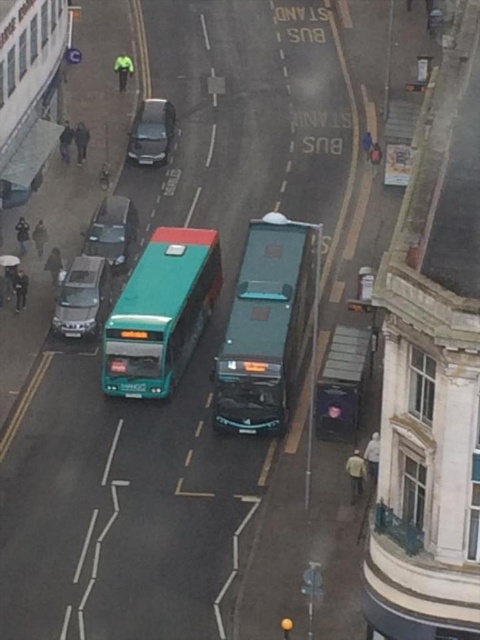
Question: Considering the relative positions of teal matte bus at center and metallic gray car at center in the image provided, where is teal matte bus at center located with respect to metallic gray car at center?

Choices:
 (A) below
 (B) above

Answer: (A)

Question: Estimate the real-world distances between objects in this image. Which object is farther from the green matte bus at center?

Choices:
 (A) metallic silver car at center-left
 (B) satin silver suv at left
 (C) metallic gray car at center
 (D) teal matte bus at center

Answer: (C)

Question: Can you confirm if green matte bus at center is positioned to the right of metallic gray car at center?

Choices:
 (A) yes
 (B) no

Answer: (A)

Question: Does green matte bus at center appear under metallic gray car at center?

Choices:
 (A) no
 (B) yes

Answer: (B)

Question: Which point is farther to the camera?

Choices:
 (A) metallic gray car at center
 (B) metallic silver car at center-left
 (C) teal matte bus at center

Answer: (A)

Question: Estimate the real-world distances between objects in this image. Which object is farther from the metallic silver car at center-left?

Choices:
 (A) satin silver suv at left
 (B) metallic gray car at center

Answer: (B)